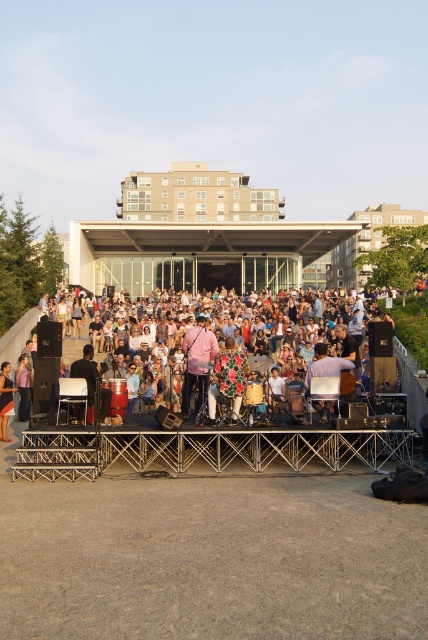
You are a stagehand who needs to place a new amplifier that is 2 meters wide. The amplifier must be placed between the beige concrete amphitheater at center and the matte black drum at center. Can the amplifier fit in the space between them?

The beige concrete amphitheater at center is wider than the matte black drum at center. However, the description does not provide the exact distance between them, so it is unclear if the 2 meter wide amplifier can fit. Additional measurements are needed to determine this.

You are attending an outdoor concert and want to find the best spot to watch the stage. The beige concrete amphitheater at center is where the stage is located. Based on its position, where should you stand to have a clear view of the performers?

The beige concrete amphitheater at center is located at point [196,236], so standing directly in front of this coordinate would provide the best vantage point for viewing the stage and performers clearly.